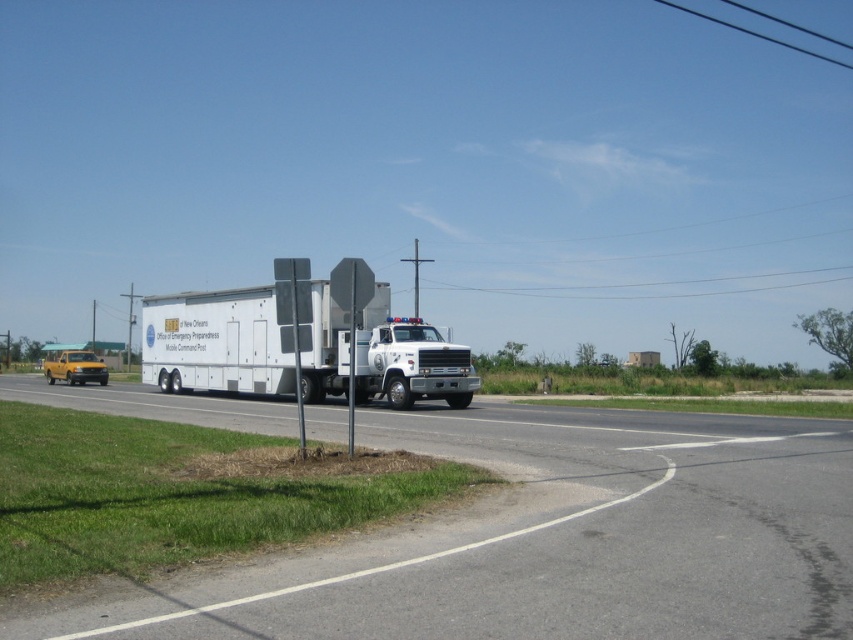
Question: Is asphalt road at center to the left of white matte trailer truck at center from the viewer's perspective?

Choices:
 (A) no
 (B) yes

Answer: (A)

Question: Which of the following is the farthest from the observer?

Choices:
 (A) (544, 531)
 (B) (287, 340)

Answer: (B)

Question: Is asphalt road at center closer to camera compared to white matte trailer truck at center?

Choices:
 (A) yes
 (B) no

Answer: (A)

Question: Can you confirm if asphalt road at center is positioned below white matte trailer truck at center?

Choices:
 (A) no
 (B) yes

Answer: (B)